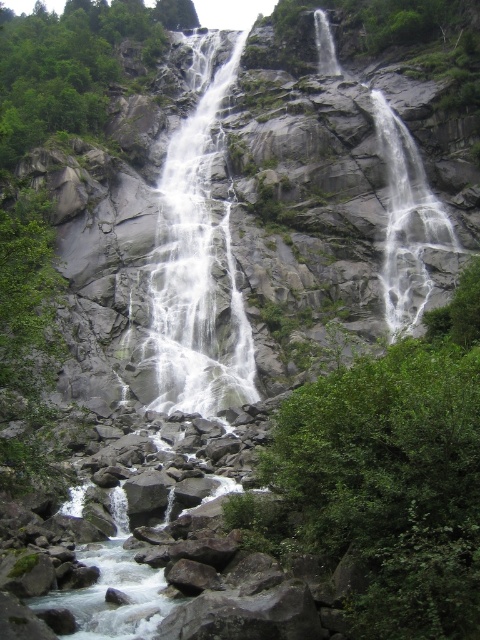
You are standing at the edge of the waterfall basin. There is a point marked at coordinates (195,268). What is located at that point?

The point at coordinates (195,268) marks the location of white frothy water at center.

You are standing at the edge of the waterfall basin and want to take a photo of the green leafy tree at center and the white smooth waterfall at upper right. If you position your camera to include both in the frame, which object might require zooming out to fully capture?

The green leafy tree at center might require zooming out to fully capture because it might be wider than the white smooth waterfall at upper right.

You are standing at the base of the waterfall and want to take a photo of the white smooth waterfall at upper right without the green leafy tree at center blocking the view. Which direction should you move to ensure the tree is out of frame?

Move to the right side of the base to position yourself so the white smooth waterfall at upper right is centered in your viewfinder, as the green leafy tree at center is currently to the left of the waterfall and will be out of frame when you shift right.